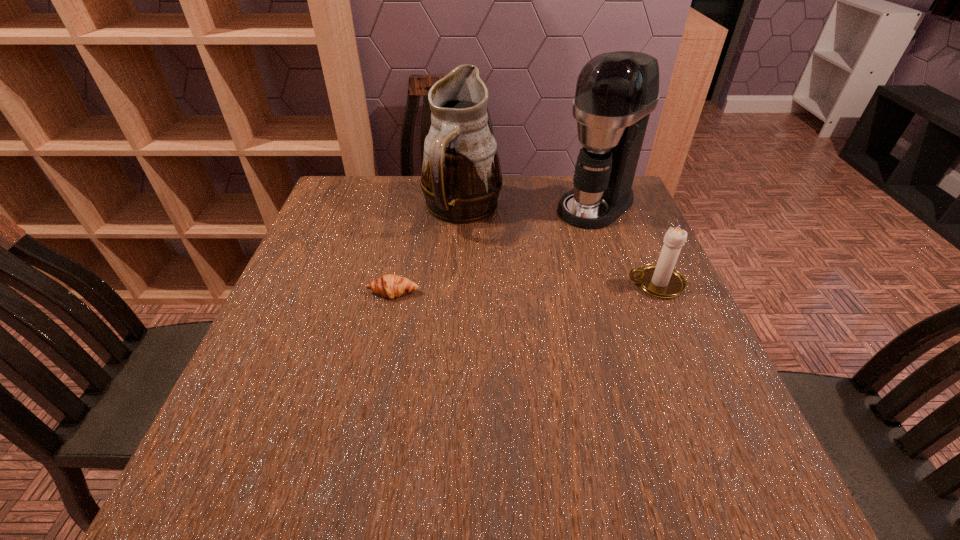
This screenshot has height=540, width=960. I want to click on free spot located 0.330m from the spout of the third shortest object, so click(531, 328).

This screenshot has height=540, width=960. Identify the location of vacant space located place cup under the spout of the coffee maker. (564, 231).

Where is `vacant position located place cup under the spout of the coffee maker`? Image resolution: width=960 pixels, height=540 pixels. vacant position located place cup under the spout of the coffee maker is located at coordinates (533, 256).

At what (x,y) coordinates should I click in order to perform the action: click on vacant space located place cup under the spout of the coffee maker. Please return your answer as a coordinate pair (x, y). The height and width of the screenshot is (540, 960). Looking at the image, I should click on (508, 277).

At what (x,y) coordinates should I click in order to perform the action: click on pitcher positioned at the far edge. Please return your answer as a coordinate pair (x, y). This screenshot has width=960, height=540. Looking at the image, I should click on (461, 178).

Where is `coffee maker present at the far edge`? coffee maker present at the far edge is located at coordinates (615, 93).

You are a GUI agent. You are given a task and a screenshot of the screen. Output one action in this format:
    pyautogui.click(x=<x>, y=<y>)
    Task: Click on the candle holder located at the right edge
    Image resolution: width=960 pixels, height=540 pixels.
    Given the screenshot: What is the action you would take?
    pyautogui.click(x=661, y=280)

Identify the location of coffee maker that is at the right edge. The height and width of the screenshot is (540, 960). (615, 93).

Identify the location of object present at the far right corner. 615,93.

Locate an element on the screen. This screenshot has width=960, height=540. vacant space at the far edge of the desktop is located at coordinates (389, 209).